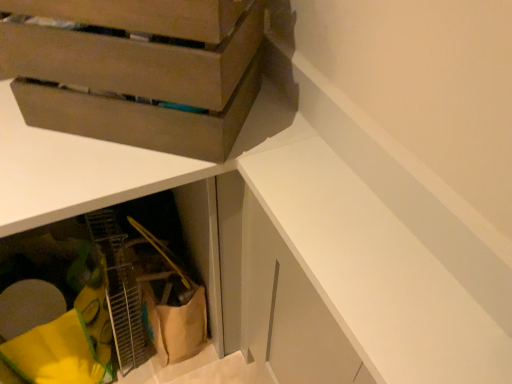
I want to click on vacant space in front of white matte cabinet at upper right, acting as the first cabinetry starting from the front, so click(364, 251).